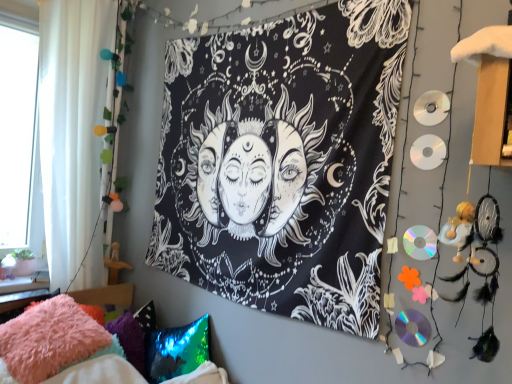
Describe the element at coordinates (283, 162) in the screenshot. This screenshot has width=512, height=384. I see `black fabric tapestry at center` at that location.

Describe the element at coordinates (176, 350) in the screenshot. This screenshot has width=512, height=384. I see `holographic sequin pillow at lower left, marked as the 2th pillow in a left-to-right arrangement` at that location.

Identify the location of black fabric tapestry at center. (283, 162).

Is fuzzy pink pillow at lower left oriented towards fluffy pink pillow at lower left, which ranks as the 2th pillow in right-to-left order?

No, fuzzy pink pillow at lower left is not facing towards fluffy pink pillow at lower left, which ranks as the 2th pillow in right-to-left order.

Considering the positions of points (46, 304) and (50, 376), is point (46, 304) closer to camera compared to point (50, 376)?

No, it is not.

Would you say fuzzy pink pillow at lower left is inside or outside fluffy pink pillow at lower left, which ranks as the 2th pillow in right-to-left order?

fuzzy pink pillow at lower left is not inside fluffy pink pillow at lower left, which ranks as the 2th pillow in right-to-left order, it's outside.

From the image's perspective, which object appears higher, fuzzy pink pillow at lower left or fluffy pink pillow at lower left, which ranks as the 2th pillow in right-to-left order?

fluffy pink pillow at lower left, which ranks as the 2th pillow in right-to-left order, appears higher in the image.

Who is more distant, white sheer curtain at left or black fabric tapestry at center?

white sheer curtain at left is more distant.

Is white sheer curtain at left wider than black fabric tapestry at center?

Yes.

Considering the sizes of objects white sheer curtain at left and black fabric tapestry at center in the image provided, who is taller, white sheer curtain at left or black fabric tapestry at center?

white sheer curtain at left is taller.

From a real-world perspective, is white sheer curtain at left over black fabric tapestry at center?

Indeed, from a real-world perspective, white sheer curtain at left stands above black fabric tapestry at center.

From the image's perspective, is fuzzy pink pillow at lower left over white sheer curtain at left?

No.

Considering the sizes of fuzzy pink pillow at lower left and white sheer curtain at left in the image, is fuzzy pink pillow at lower left taller or shorter than white sheer curtain at left?

Clearly, fuzzy pink pillow at lower left is shorter compared to white sheer curtain at left.

Based on their positions, is fuzzy pink pillow at lower left located to the left or right of white sheer curtain at left?

Based on their positions, fuzzy pink pillow at lower left is located to the right of white sheer curtain at left.

Could you tell me if fuzzy pink pillow at lower left is turned towards white sheer curtain at left?

No, fuzzy pink pillow at lower left is not facing towards white sheer curtain at left.

Is holographic sequin pillow at lower left, marked as the 2th pillow in a left-to-right arrangement, to the left of fuzzy pink pillow at lower left from the viewer's perspective?

Incorrect, holographic sequin pillow at lower left, marked as the 2th pillow in a left-to-right arrangement, is not on the left side of fuzzy pink pillow at lower left.

Is there a large distance between holographic sequin pillow at lower left, marked as the 2th pillow in a left-to-right arrangement, and fuzzy pink pillow at lower left?

No, holographic sequin pillow at lower left, marked as the 2th pillow in a left-to-right arrangement, is not far away from fuzzy pink pillow at lower left.

Can we say holographic sequin pillow at lower left, marked as the 2th pillow in a left-to-right arrangement, lies outside fuzzy pink pillow at lower left?

That's incorrect, holographic sequin pillow at lower left, marked as the 2th pillow in a left-to-right arrangement, is not completely outside fuzzy pink pillow at lower left.

Is holographic sequin pillow at lower left, the 1th pillow when ordered from right to left, facing away from fuzzy pink pillow at lower left?

Yes, holographic sequin pillow at lower left, the 1th pillow when ordered from right to left, is facing away from fuzzy pink pillow at lower left.

Is black fabric tapestry at center not inside fuzzy pink pillow at lower left?

Yes, black fabric tapestry at center is not within fuzzy pink pillow at lower left.

Considering the relative sizes of black fabric tapestry at center and fuzzy pink pillow at lower left in the image provided, is black fabric tapestry at center bigger than fuzzy pink pillow at lower left?

Incorrect, black fabric tapestry at center is not larger than fuzzy pink pillow at lower left.

Is black fabric tapestry at center placed right next to fuzzy pink pillow at lower left?

black fabric tapestry at center and fuzzy pink pillow at lower left are not in contact.

What's the angular difference between white sheer curtain at left and fluffy pink pillow at lower left, which is the first pillow in left-to-right order,'s facing directions?

2.21 degrees separate the facing orientations of white sheer curtain at left and fluffy pink pillow at lower left, which is the first pillow in left-to-right order.

The width and height of the screenshot is (512, 384). I want to click on curtain above the fluffy pink pillow at lower left, which is the first pillow in left-to-right order (from a real-world perspective), so click(72, 125).

Is point (48, 207) positioned in front of point (12, 370)?

No, (48, 207) is further to viewer.

From a real-world perspective, which is physically above, white sheer curtain at left or fluffy pink pillow at lower left, which is the first pillow in left-to-right order?

In real-world perspective, white sheer curtain at left is above.

Is fuzzy pink pillow at lower left aimed at holographic sequin pillow at lower left, the 1th pillow when ordered from right to left?

No, fuzzy pink pillow at lower left is not oriented towards holographic sequin pillow at lower left, the 1th pillow when ordered from right to left.

In the scene shown: Can you confirm if fuzzy pink pillow at lower left is taller than holographic sequin pillow at lower left, marked as the 2th pillow in a left-to-right arrangement?

Indeed, fuzzy pink pillow at lower left has a greater height compared to holographic sequin pillow at lower left, marked as the 2th pillow in a left-to-right arrangement.

Which point is more distant from viewer, (3,347) or (148,347)?

Point (148,347)

Which is behind, fuzzy pink pillow at lower left or holographic sequin pillow at lower left, the 1th pillow when ordered from right to left?

holographic sequin pillow at lower left, the 1th pillow when ordered from right to left, is behind.

Image resolution: width=512 pixels, height=384 pixels. Find the location of `furniture below the fluffy pink pillow at lower left, which ranks as the 2th pillow in right-to-left order (from the image's perspective)`. furniture below the fluffy pink pillow at lower left, which ranks as the 2th pillow in right-to-left order (from the image's perspective) is located at coordinates (60, 348).

You are a GUI agent. You are given a task and a screenshot of the screen. Output one action in this format:
    pyautogui.click(x=<x>, y=<y>)
    Task: Click on the bulletin board below the white sheer curtain at left (from a real-world perspective)
    The width and height of the screenshot is (512, 384).
    Given the screenshot: What is the action you would take?
    pyautogui.click(x=283, y=162)

Based on their spatial positions, is holographic sequin pillow at lower left, marked as the 2th pillow in a left-to-right arrangement, or fuzzy pink pillow at lower left closer to white sheer curtain at left?

The object closer to white sheer curtain at left is fuzzy pink pillow at lower left.

Looking at this image, based on their spatial positions, is holographic sequin pillow at lower left, the 1th pillow when ordered from right to left, or fuzzy pink pillow at lower left further from fluffy pink pillow at lower left, which is the first pillow in left-to-right order?

holographic sequin pillow at lower left, the 1th pillow when ordered from right to left, is positioned further to the anchor fluffy pink pillow at lower left, which is the first pillow in left-to-right order.

From the image, which object appears to be nearer to fluffy pink pillow at lower left, which ranks as the 2th pillow in right-to-left order, black fabric tapestry at center or fuzzy pink pillow at lower left?

Based on the image, fuzzy pink pillow at lower left appears to be nearer to fluffy pink pillow at lower left, which ranks as the 2th pillow in right-to-left order.

From the image, which object appears to be nearer to fluffy pink pillow at lower left, which ranks as the 2th pillow in right-to-left order, white sheer curtain at left or fuzzy pink pillow at lower left?

fuzzy pink pillow at lower left is closer to fluffy pink pillow at lower left, which ranks as the 2th pillow in right-to-left order.

Looking at the image, which one is located closer to white sheer curtain at left, black fabric tapestry at center or fluffy pink pillow at lower left, which ranks as the 2th pillow in right-to-left order?

Among the two, fluffy pink pillow at lower left, which ranks as the 2th pillow in right-to-left order, is located nearer to white sheer curtain at left.

Estimate the real-world distances between objects in this image. Which object is further from fluffy pink pillow at lower left, which is the first pillow in left-to-right order, holographic sequin pillow at lower left, marked as the 2th pillow in a left-to-right arrangement, or white sheer curtain at left?

The object further to fluffy pink pillow at lower left, which is the first pillow in left-to-right order, is white sheer curtain at left.

Looking at the image, which one is located closer to fluffy pink pillow at lower left, which ranks as the 2th pillow in right-to-left order, fuzzy pink pillow at lower left or holographic sequin pillow at lower left, marked as the 2th pillow in a left-to-right arrangement?

fuzzy pink pillow at lower left is positioned closer to the anchor fluffy pink pillow at lower left, which ranks as the 2th pillow in right-to-left order.

From the image, which object appears to be farther from holographic sequin pillow at lower left, marked as the 2th pillow in a left-to-right arrangement, fuzzy pink pillow at lower left or black fabric tapestry at center?

Based on the image, black fabric tapestry at center appears to be further to holographic sequin pillow at lower left, marked as the 2th pillow in a left-to-right arrangement.

Where is `bulletin board between white sheer curtain at left and holographic sequin pillow at lower left, the 1th pillow when ordered from right to left, in the up-down direction`? The width and height of the screenshot is (512, 384). bulletin board between white sheer curtain at left and holographic sequin pillow at lower left, the 1th pillow when ordered from right to left, in the up-down direction is located at coordinates (283, 162).

This screenshot has width=512, height=384. In order to click on pillow between fuzzy pink pillow at lower left and holographic sequin pillow at lower left, marked as the 2th pillow in a left-to-right arrangement, along the z-axis in this screenshot , I will do `click(48, 340)`.

Image resolution: width=512 pixels, height=384 pixels. Identify the location of bulletin board between fuzzy pink pillow at lower left and white sheer curtain at left along the z-axis. (283, 162).

What are the coordinates of `bulletin board between white sheer curtain at left and fluffy pink pillow at lower left, which is the first pillow in left-to-right order, vertically` in the screenshot? It's located at (283, 162).